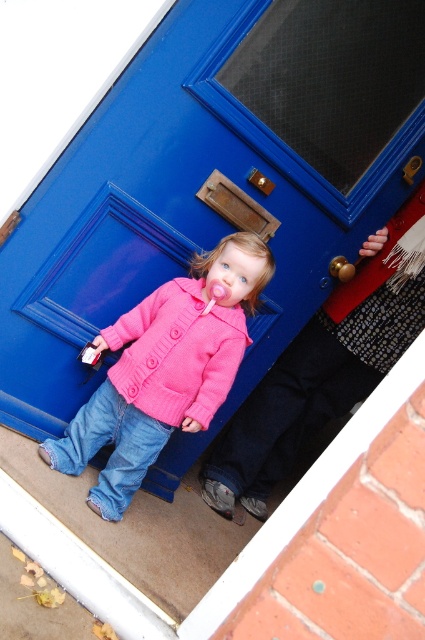
Question: Among these points, which one is farthest from the camera?

Choices:
 (A) (76, 458)
 (B) (283, 196)

Answer: (B)

Question: Is blue matte door at center positioned at the back of pink knitted jacket at lower left?

Choices:
 (A) no
 (B) yes

Answer: (A)

Question: Is blue matte door at center positioned in front of pink knitted sweater at center?

Choices:
 (A) no
 (B) yes

Answer: (B)

Question: Which point appears farthest from the camera in this image?

Choices:
 (A) (138, 397)
 (B) (226, 118)

Answer: (A)

Question: Does blue matte door at center appear on the right side of pink knitted sweater at center?

Choices:
 (A) no
 (B) yes

Answer: (B)

Question: Which object is the closest to the pink knitted sweater at center?

Choices:
 (A) pink knitted jacket at lower left
 (B) blue matte door at center

Answer: (A)